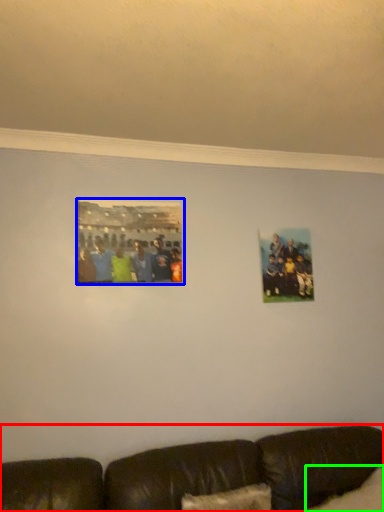
Question: Based on their relative distances, which object is nearer to studio couch (highlighted by a red box)? Choose from picture frame (highlighted by a blue box) and pillow (highlighted by a green box).

Choices:
 (A) picture frame
 (B) pillow

Answer: (B)